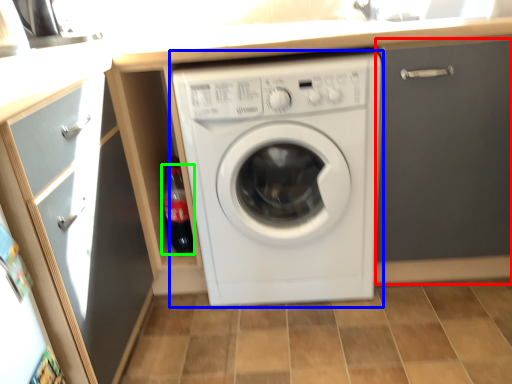
Question: Estimate the real-world distances between objects in this image. Which object is closer to door (highlighted by a red box), washing machine (highlighted by a blue box) or bottle (highlighted by a green box)?

Choices:
 (A) washing machine
 (B) bottle

Answer: (A)